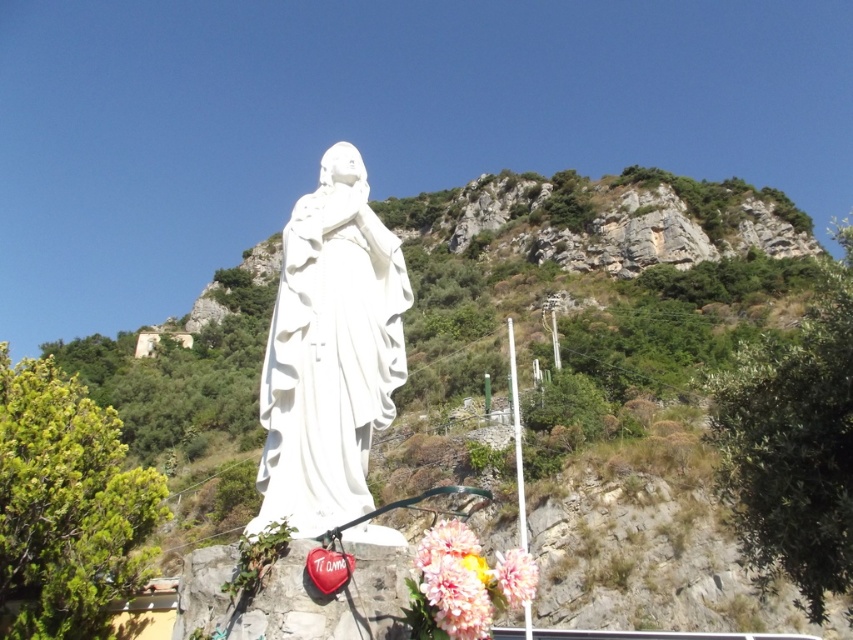
Does pastel pink fabric flowers at lower center have a lesser height compared to fluffy silk flower at lower center?

Incorrect, pastel pink fabric flowers at lower center's height does not fall short of fluffy silk flower at lower center's.

The image size is (853, 640). Describe the element at coordinates (463, 582) in the screenshot. I see `pastel pink fabric flowers at lower center` at that location.

Who is more distant from viewer, (492, 586) or (526, 580)?

Positioned behind is point (492, 586).

You are a GUI agent. You are given a task and a screenshot of the screen. Output one action in this format:
    pyautogui.click(x=<x>, y=<y>)
    Task: Click on the pastel pink fabric flowers at lower center
    The image size is (853, 640).
    Given the screenshot: What is the action you would take?
    pyautogui.click(x=463, y=582)

Locate an element on the screen. The width and height of the screenshot is (853, 640). green leafy hillside at center is located at coordinates (595, 372).

Is point (180, 448) closer to viewer compared to point (512, 604)?

No, (180, 448) is further to viewer.

Locate an element on the screen. The height and width of the screenshot is (640, 853). green leafy hillside at center is located at coordinates (595, 372).

Is green leafy hillside at center smaller than white marble statue at center?

No.

Does green leafy hillside at center have a greater height compared to white marble statue at center?

Yes.

Is point (497, 483) positioned after point (392, 298)?

Yes, point (497, 483) is behind point (392, 298).

Locate an element on the screen. The image size is (853, 640). green leafy hillside at center is located at coordinates (595, 372).